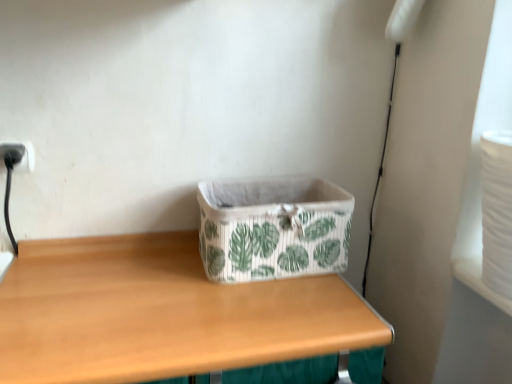
The image size is (512, 384). What are the coordinates of `blank space to the left of white fabric storage box at center` in the screenshot? It's located at (155, 277).